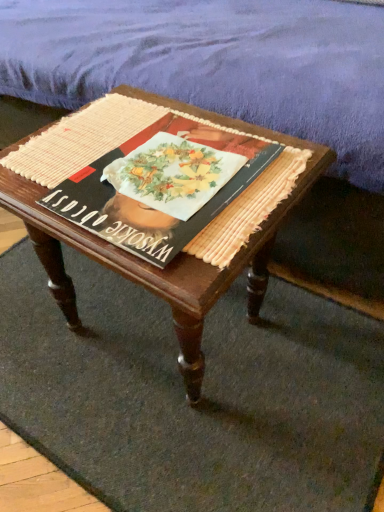
What is the approximate width of wooden coffee table at center?

15.00 inches.

You are a GUI agent. You are given a task and a screenshot of the screen. Output one action in this format:
    pyautogui.click(x=<x>, y=<y>)
    Task: Click on the purple fabric mattress at upper center
    The height and width of the screenshot is (512, 384).
    Given the screenshot: What is the action you would take?
    pyautogui.click(x=215, y=64)

What do you see at coordinates (215, 64) in the screenshot? I see `purple fabric mattress at upper center` at bounding box center [215, 64].

The width and height of the screenshot is (384, 512). I want to click on matte black book at center, so click(151, 208).

From a real-world perspective, which is physically below, matte black book at center or woven beige doormat at center?

woven beige doormat at center, from a real-world perspective.

Where is `doormat lying below the matte black book at center (from the image's perspective)`? doormat lying below the matte black book at center (from the image's perspective) is located at coordinates (184, 395).

Is matte black book at center situated inside woven beige doormat at center or outside?

matte black book at center is not inside woven beige doormat at center, it's outside.

Does matte black book at center have a larger size compared to woven beige doormat at center?

Incorrect, matte black book at center is not larger than woven beige doormat at center.

Is wooden coffee table at center outside of woven beige doormat at center?

Yes, wooden coffee table at center is outside of woven beige doormat at center.

Considering the relative sizes of wooden coffee table at center and woven beige doormat at center in the image provided, is wooden coffee table at center taller than woven beige doormat at center?

Indeed, wooden coffee table at center has a greater height compared to woven beige doormat at center.

Between point (258, 234) and point (170, 476), which one is positioned behind?

Point (170, 476)

Where is `doormat that is behind the wooden coffee table at center`? doormat that is behind the wooden coffee table at center is located at coordinates coord(184,395).

How many degrees apart are the facing directions of purple fabric mattress at upper center and wooden coffee table at center?

purple fabric mattress at upper center and wooden coffee table at center are facing 2.83 degrees away from each other.

Between purple fabric mattress at upper center and wooden coffee table at center, which one has more height?

Standing taller between the two is purple fabric mattress at upper center.

Is purple fabric mattress at upper center oriented away from wooden coffee table at center?

No, purple fabric mattress at upper center is not facing the opposite direction of wooden coffee table at center.

Between purple fabric mattress at upper center and matte black book at center, which one appears on the right side from the viewer's perspective?

From the viewer's perspective, matte black book at center appears more on the right side.

Considering the relative sizes of purple fabric mattress at upper center and matte black book at center in the image provided, is purple fabric mattress at upper center smaller than matte black book at center?

No.

From the picture: Is the surface of purple fabric mattress at upper center in direct contact with matte black book at center?

purple fabric mattress at upper center is not next to matte black book at center, and they're not touching.

In terms of width, does purple fabric mattress at upper center look wider or thinner when compared to matte black book at center?

In the image, purple fabric mattress at upper center appears to be wider than matte black book at center.

The image size is (384, 512). Identify the location of paperback book lying on the right of wooden coffee table at center. (151, 208).

Consider the image. Would you say matte black book at center is inside or outside wooden coffee table at center?

matte black book at center can be found inside wooden coffee table at center.

From a real-world perspective, is matte black book at center beneath wooden coffee table at center?

No, from a real-world perspective, matte black book at center is not beneath wooden coffee table at center.

Is purple fabric mattress at upper center a part of matte black book at center?

No, purple fabric mattress at upper center is not inside matte black book at center.

Considering the sizes of matte black book at center and purple fabric mattress at upper center in the image, is matte black book at center bigger or smaller than purple fabric mattress at upper center?

In the image, matte black book at center appears to be smaller than purple fabric mattress at upper center.

Are matte black book at center and purple fabric mattress at upper center making contact?

No, matte black book at center is not in contact with purple fabric mattress at upper center.

In terms of height, does matte black book at center look taller or shorter compared to purple fabric mattress at upper center?

In the image, matte black book at center appears to be shorter than purple fabric mattress at upper center.

Which object is closer to the camera taking this photo, woven beige doormat at center or purple fabric mattress at upper center?

purple fabric mattress at upper center is more forward.

Who is bigger, woven beige doormat at center or purple fabric mattress at upper center?

purple fabric mattress at upper center.

Considering the positions of point (237, 371) and point (342, 8), is point (237, 371) closer or farther from the camera than point (342, 8)?

Point (237, 371) appears to be closer to the viewer than point (342, 8).

Is woven beige doormat at center not close to purple fabric mattress at upper center?

That's not correct — woven beige doormat at center is a little close to purple fabric mattress at upper center.

This screenshot has width=384, height=512. What are the coordinates of `doormat below the matte black book at center (from a real-world perspective)` in the screenshot? It's located at (184, 395).

The height and width of the screenshot is (512, 384). What are the coordinates of `doormat lying below the wooden coffee table at center (from the image's perspective)` in the screenshot? It's located at (184, 395).

Which object lies nearer to the anchor point woven beige doormat at center, purple fabric mattress at upper center or wooden coffee table at center?

The object closer to woven beige doormat at center is wooden coffee table at center.

Considering their positions, is purple fabric mattress at upper center positioned closer to woven beige doormat at center than matte black book at center?

matte black book at center is positioned closer to the anchor woven beige doormat at center.

From the image, which object appears to be nearer to woven beige doormat at center, wooden coffee table at center or matte black book at center?

wooden coffee table at center.

Considering their positions, is wooden coffee table at center positioned closer to purple fabric mattress at upper center than matte black book at center?

Based on the image, wooden coffee table at center appears to be nearer to purple fabric mattress at upper center.

Looking at the image, which one is located further to wooden coffee table at center, woven beige doormat at center or matte black book at center?

woven beige doormat at center lies further to wooden coffee table at center than the other object.

From the image, which object appears to be farther from purple fabric mattress at upper center, woven beige doormat at center or wooden coffee table at center?

woven beige doormat at center lies further to purple fabric mattress at upper center than the other object.

In the scene shown: Which object lies nearer to the anchor point wooden coffee table at center, matte black book at center or woven beige doormat at center?

matte black book at center is closer to wooden coffee table at center.

Estimate the real-world distances between objects in this image. Which object is closer to wooden coffee table at center, purple fabric mattress at upper center or matte black book at center?

matte black book at center is closer to wooden coffee table at center.

Image resolution: width=384 pixels, height=512 pixels. What are the coordinates of `coffee table between matte black book at center and woven beige doormat at center in the vertical direction` in the screenshot? It's located at (177, 257).

Identify the location of coffee table that lies between purple fabric mattress at upper center and woven beige doormat at center from top to bottom. The width and height of the screenshot is (384, 512). (177, 257).

Identify the location of paperback book between purple fabric mattress at upper center and woven beige doormat at center in the up-down direction. (151, 208).

You are a GUI agent. You are given a task and a screenshot of the screen. Output one action in this format:
    pyautogui.click(x=<x>, y=<y>)
    Task: Click on the paperback book between purple fabric mattress at upper center and wooden coffee table at center in the vertical direction
    This screenshot has height=512, width=384.
    Given the screenshot: What is the action you would take?
    pyautogui.click(x=151, y=208)